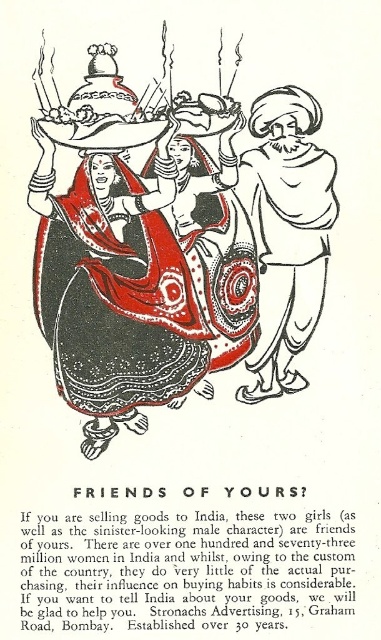
Question: Which point is closer to the camera?

Choices:
 (A) matte black dress at center
 (B) white paper turban at center

Answer: (A)

Question: Does matte black dress at center come in front of white paper turban at center?

Choices:
 (A) yes
 (B) no

Answer: (A)

Question: Which point is closer to the camera?

Choices:
 (A) (256, 132)
 (B) (289, 285)

Answer: (B)

Question: Can you confirm if matte black dress at center is positioned to the left of white paper turban at center?

Choices:
 (A) no
 (B) yes

Answer: (B)

Question: Among these points, which one is farthest from the camera?

Choices:
 (A) (289, 225)
 (B) (299, 333)

Answer: (A)

Question: Is matte black dress at center below white paper turban at center?

Choices:
 (A) yes
 (B) no

Answer: (A)